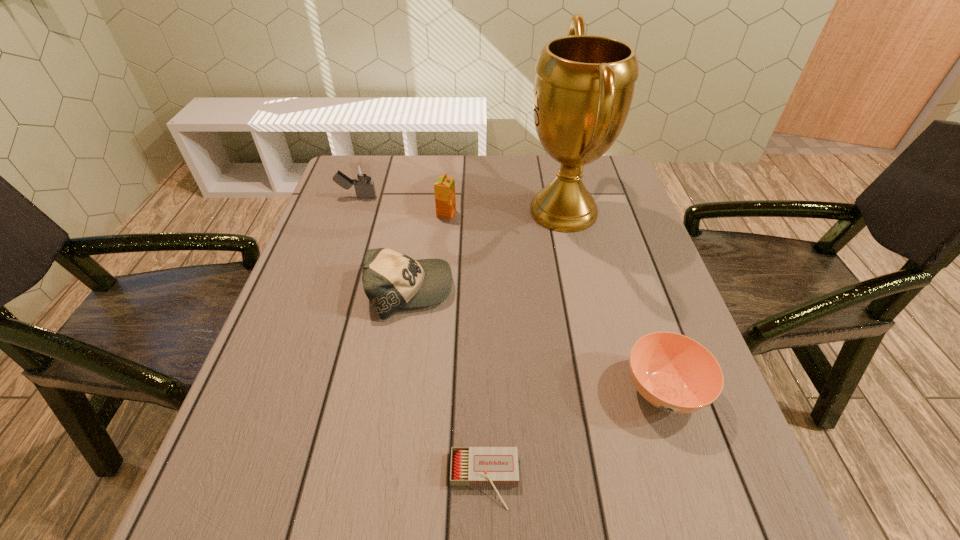
What are the coordinates of `object at the far left corner` in the screenshot? It's located at [x=361, y=173].

I want to click on object present at the far right corner, so click(x=584, y=84).

Image resolution: width=960 pixels, height=540 pixels. What are the coordinates of `vacant space at the far edge` in the screenshot? It's located at (448, 165).

The height and width of the screenshot is (540, 960). Identify the location of free location at the near edge. (325, 538).

Find the location of `vacant space at the left edge`. vacant space at the left edge is located at coordinates (268, 418).

Find the location of a particular element. free space at the right edge is located at coordinates (592, 264).

This screenshot has height=540, width=960. What are the coordinates of `free spot at the far right corner of the desktop` in the screenshot? It's located at (619, 184).

You are a GUI agent. You are given a task and a screenshot of the screen. Output one action in this format:
    pyautogui.click(x=<x>, y=<y>)
    Task: Click on the empty space between the soup bowl and the fourth object from left to right
    Image resolution: width=960 pixels, height=540 pixels.
    Given the screenshot: What is the action you would take?
    pyautogui.click(x=574, y=435)

Locate an element on the screen. The image size is (960, 540). free space between the tallest object and the fifth farthest object is located at coordinates (613, 301).

Locate an element on the screen. The width and height of the screenshot is (960, 540). free point between the orange juice and the soup bowl is located at coordinates (555, 302).